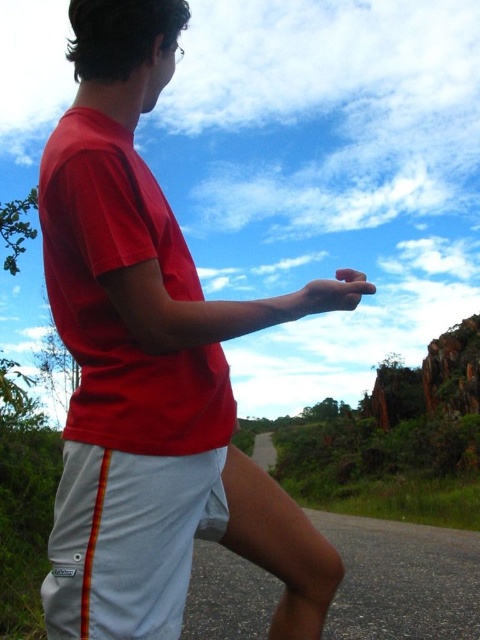
Is red matte shirt at center smaller than matte red t-shirt at center?

No, red matte shirt at center is not smaller than matte red t-shirt at center.

Measure the distance between red matte shirt at center and camera.

The distance of red matte shirt at center from camera is 12.11 meters.

Where is `red matte shirt at center`? red matte shirt at center is located at coordinates (152, 365).

Does matte red t-shirt at center have a greater width compared to white cotton shorts at lower center?

Yes, matte red t-shirt at center is wider than white cotton shorts at lower center.

Which of these two, matte red t-shirt at center or white cotton shorts at lower center, stands taller?

matte red t-shirt at center is taller.

Is point (95, 140) positioned in front of point (146, 566)?

No, (95, 140) is further to viewer.

This screenshot has width=480, height=640. I want to click on matte red t-shirt at center, so point(113,307).

Does red matte shirt at center have a larger size compared to white cotton shorts at lower center?

Indeed, red matte shirt at center has a larger size compared to white cotton shorts at lower center.

Between point (298, 624) and point (130, 515), which one is positioned behind?

The point (298, 624) is behind.

Between point (143, 257) and point (171, 628), which one is positioned in front?

Positioned in front is point (171, 628).

Identify the location of red matte shirt at center. (152, 365).